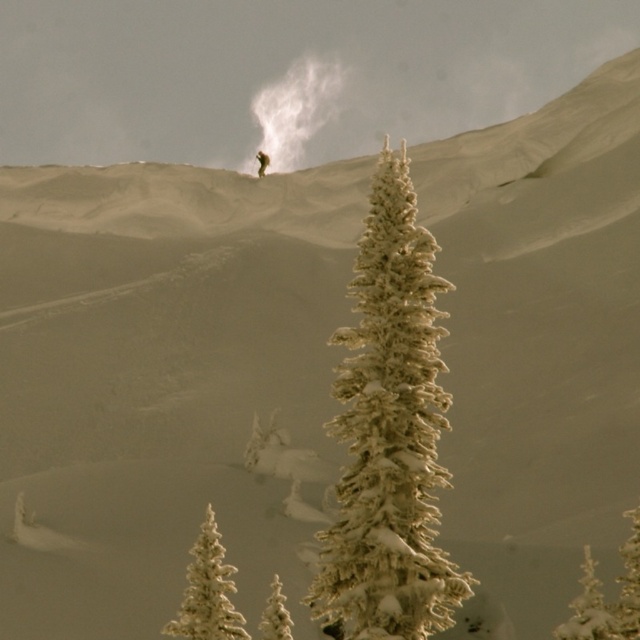
You are standing in the winter landscape and want to take a photo of both the white frosty tree at lower right and the white frosty tree at lower center. Which tree should you focus on first to ensure both are in the frame?

You should focus on the white frosty tree at lower center first because it is closer to you than the white frosty tree at lower right, which is further away. This way, adjusting the camera to include both will be easier since the closer tree is your starting point.

You are planning to take a photo of the winter landscape. You want to include both the white frosty tree at lower right and the white frosty tree at lower center in your shot. Which tree should you focus on first if you want to ensure both are in frame without moving the camera?

You should focus on the white frosty tree at lower center first because it is smaller in size compared to the white frosty tree at lower right. By centering the smaller tree first, you can adjust the framing to include the larger tree without needing to reposition the camera.

You are a photographer standing at the center of the scene. You want to capture a photo that includes both the white frosty tree at lower left and the person skiing in the midground. Based on their positions, where should you position your camera to ensure both subjects are in frame?

The white frosty tree at lower left is located at point (208, 592). To include both it and the person skiing in the midground, position your camera centrally so that the tree and the skier are within the frame.